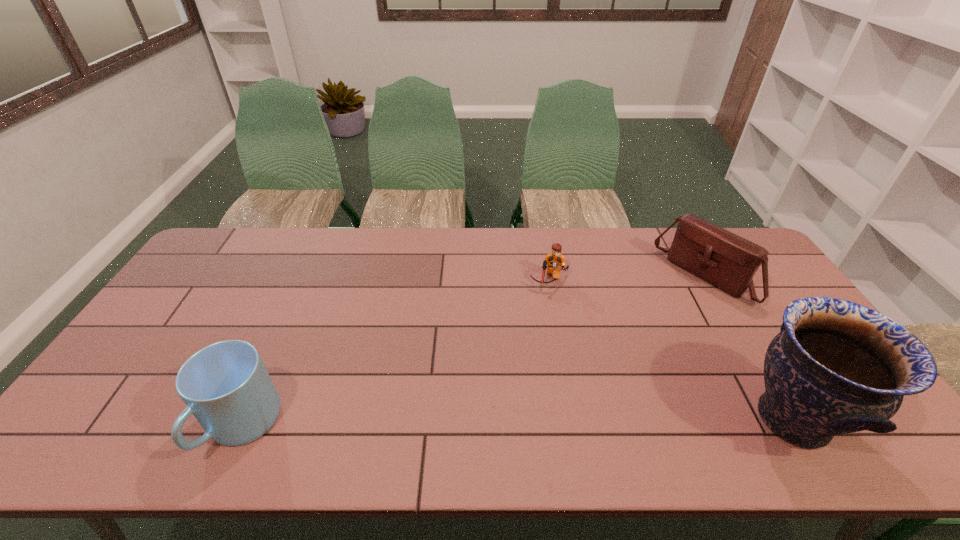
Locate an element on the screen. Image resolution: width=960 pixels, height=540 pixels. mug is located at coordinates (226, 386).

Locate an element on the screen. Image resolution: width=960 pixels, height=540 pixels. the tallest object is located at coordinates [x=836, y=367].

Where is `the second object from left to right`? the second object from left to right is located at coordinates (554, 260).

Image resolution: width=960 pixels, height=540 pixels. Find the location of `the shortest object`. the shortest object is located at coordinates (554, 260).

I want to click on shoulder bag, so click(x=729, y=262).

At what (x,y) coordinates should I click in order to perform the action: click on vacant space located on the back of the mug. Please return your answer as a coordinate pair (x, y). Looking at the image, I should click on (305, 285).

I want to click on free space located on the front handle of the pottery, so click(x=676, y=419).

At what (x,y) coordinates should I click in order to perform the action: click on free region located on the front handle of the pottery. Please return your answer as a coordinate pair (x, y). Looking at the image, I should click on (676, 419).

Where is `vacant space positioned 0.210m on the front handle of the pottery`? Image resolution: width=960 pixels, height=540 pixels. vacant space positioned 0.210m on the front handle of the pottery is located at coordinates (651, 419).

Where is `vacant region located holding a crossbow in the hands of the third object from right to left`? vacant region located holding a crossbow in the hands of the third object from right to left is located at coordinates (543, 318).